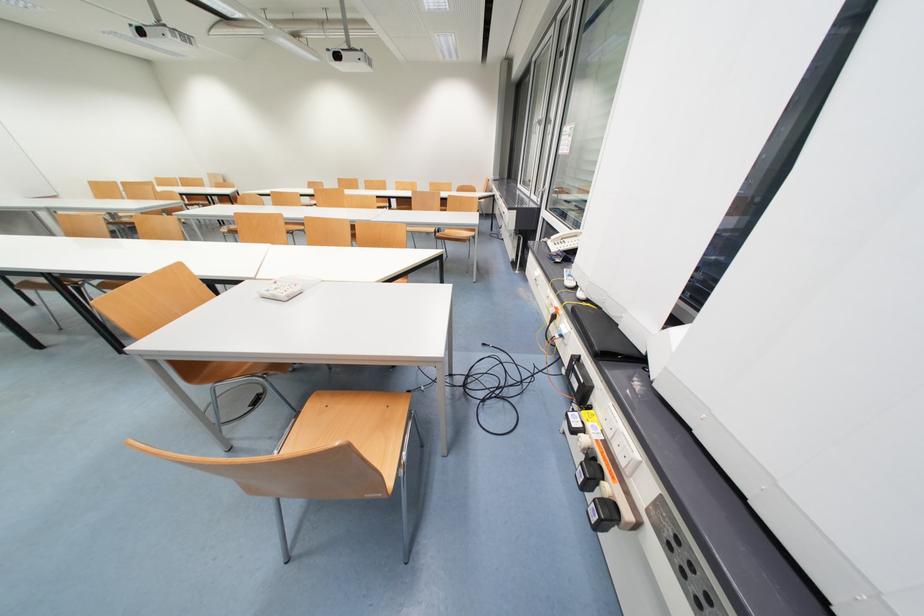
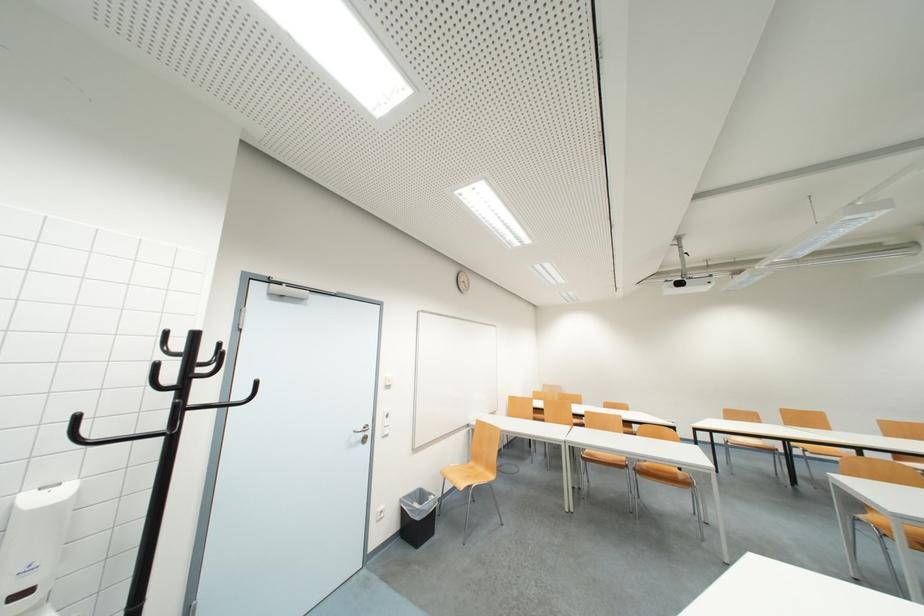
In the second image, find the point that corresponds to point (317, 187) in the first image.

(736, 416)